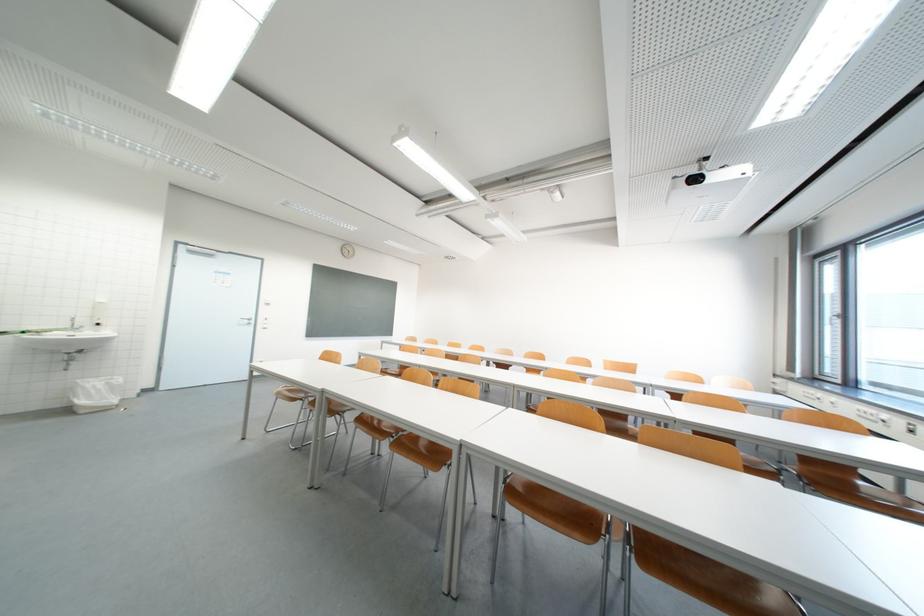
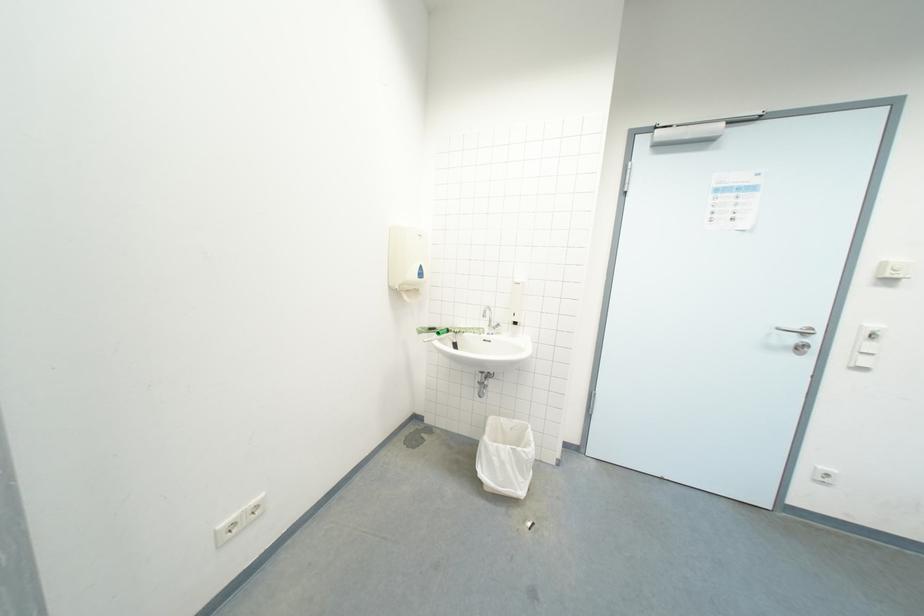
Where in the second image is the point corresponding to [93,323] from the first image?

(511, 318)